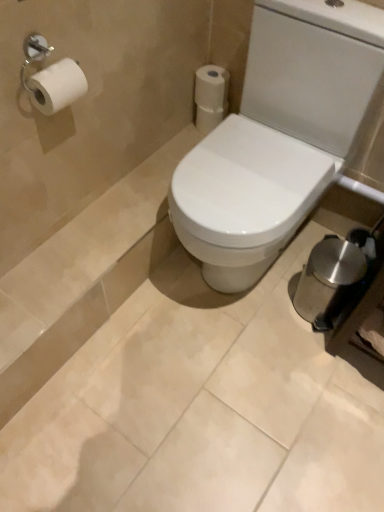
In the scene shown: Measure the distance between point [259,51] and camera.

Point [259,51] and camera are 3.94 feet apart.

Locate an element on the screen. white glossy toilet at center is located at coordinates (278, 136).

Locate an element on the screen. white glossy toilet at center is located at coordinates (278, 136).

From the image's perspective, which is above, white matte toilet paper at upper right, positioned as the 2th toilet paper in back-to-front order, or white glossy toilet at center?

white matte toilet paper at upper right, positioned as the 2th toilet paper in back-to-front order, is shown above in the image.

This screenshot has height=512, width=384. Identify the location of toilet to the right of white matte toilet paper at upper right, positioned as the 2th toilet paper in back-to-front order. (278, 136).

Are white matte toilet paper at upper right, positioned as the 2th toilet paper in back-to-front order, and white glossy toilet at center making contact?

No, white matte toilet paper at upper right, positioned as the 2th toilet paper in back-to-front order, is not next to white glossy toilet at center.

Is white matte toilet paper at upper right, placed as the 1th toilet paper when sorted from front to back, taller or shorter than white glossy toilet at center?

Considering their sizes, white matte toilet paper at upper right, placed as the 1th toilet paper when sorted from front to back, has less height than white glossy toilet at center.

From the image's perspective, is white matte toilet paper at upper center, arranged as the first toilet paper when viewed from the back, on white matte toilet paper at upper right, positioned as the 2th toilet paper in back-to-front order?

Incorrect, from the image's perspective, white matte toilet paper at upper center, arranged as the first toilet paper when viewed from the back, is lower than white matte toilet paper at upper right, positioned as the 2th toilet paper in back-to-front order.

Is white matte toilet paper at upper center, arranged as the first toilet paper when viewed from the back, wider or thinner than white matte toilet paper at upper right, placed as the 1th toilet paper when sorted from front to back?

In the image, white matte toilet paper at upper center, arranged as the first toilet paper when viewed from the back, appears to be wider than white matte toilet paper at upper right, placed as the 1th toilet paper when sorted from front to back.

From a real-world perspective, is white matte toilet paper at upper center, arranged as the first toilet paper when viewed from the back, over white matte toilet paper at upper right, positioned as the 2th toilet paper in back-to-front order?

Incorrect, from a real-world perspective, white matte toilet paper at upper center, arranged as the first toilet paper when viewed from the back, is lower than white matte toilet paper at upper right, positioned as the 2th toilet paper in back-to-front order.

Is white matte toilet paper at upper center, acting as the 2th toilet paper starting from the front, turned away from white matte toilet paper at upper right, placed as the 1th toilet paper when sorted from front to back?

white matte toilet paper at upper center, acting as the 2th toilet paper starting from the front, is not turned away from white matte toilet paper at upper right, placed as the 1th toilet paper when sorted from front to back.

In terms of width, does white matte toilet paper at upper center, acting as the 2th toilet paper starting from the front, look wider or thinner when compared to white glossy toilet at center?

In the image, white matte toilet paper at upper center, acting as the 2th toilet paper starting from the front, appears to be more narrow than white glossy toilet at center.

Is white matte toilet paper at upper center, arranged as the first toilet paper when viewed from the back, facing away from white glossy toilet at center?

No, white matte toilet paper at upper center, arranged as the first toilet paper when viewed from the back,'s orientation is not away from white glossy toilet at center.

Is the surface of white glossy toilet at center in direct contact with white matte toilet paper at upper center, arranged as the first toilet paper when viewed from the back?

white glossy toilet at center and white matte toilet paper at upper center, arranged as the first toilet paper when viewed from the back, are not in contact.

In the scene shown: How many degrees apart are the facing directions of white glossy toilet at center and white matte toilet paper at upper center, arranged as the first toilet paper when viewed from the back?

→ 6.78e-05 degrees.

Considering the sizes of objects white glossy toilet at center and white matte toilet paper at upper center, acting as the 2th toilet paper starting from the front, in the image provided, who is thinner, white glossy toilet at center or white matte toilet paper at upper center, acting as the 2th toilet paper starting from the front,?

white matte toilet paper at upper center, acting as the 2th toilet paper starting from the front, is thinner.

Between white glossy toilet at center and white matte toilet paper at upper center, arranged as the first toilet paper when viewed from the back, which one has smaller size?

Smaller between the two is white matte toilet paper at upper center, arranged as the first toilet paper when viewed from the back.

Identify the location of toilet paper on the left of the white matte toilet paper at upper center, acting as the 2th toilet paper starting from the front. (212, 88).

Is white matte toilet paper at upper right, placed as the 1th toilet paper when sorted from front to back, in front of or behind white matte toilet paper at upper center, arranged as the first toilet paper when viewed from the back, in the image?

Clearly, white matte toilet paper at upper right, placed as the 1th toilet paper when sorted from front to back, is in front of white matte toilet paper at upper center, arranged as the first toilet paper when viewed from the back.

From a real-world perspective, which object stands above the other?

In real-world perspective, white matte toilet paper at upper right, placed as the 1th toilet paper when sorted from front to back, is above.

Is white matte toilet paper at upper right, placed as the 1th toilet paper when sorted from front to back, turned away from white matte toilet paper at upper center, arranged as the first toilet paper when viewed from the back?

white matte toilet paper at upper right, placed as the 1th toilet paper when sorted from front to back, is not turned away from white matte toilet paper at upper center, arranged as the first toilet paper when viewed from the back.

Which is behind, white glossy toilet at center or white matte toilet paper at upper right, positioned as the 2th toilet paper in back-to-front order?

white matte toilet paper at upper right, positioned as the 2th toilet paper in back-to-front order, is further from the camera.

Can you tell me how much white glossy toilet at center and white matte toilet paper at upper right, positioned as the 2th toilet paper in back-to-front order, differ in facing direction?

There is a 5.05e-05-degree angle between the facing directions of white glossy toilet at center and white matte toilet paper at upper right, positioned as the 2th toilet paper in back-to-front order.

Are white glossy toilet at center and white matte toilet paper at upper right, positioned as the 2th toilet paper in back-to-front order, located far from each other?

white glossy toilet at center is actually quite close to white matte toilet paper at upper right, positioned as the 2th toilet paper in back-to-front order.

Locate an element on the screen. toilet on the right of white matte toilet paper at upper right, positioned as the 2th toilet paper in back-to-front order is located at coordinates (278, 136).

Where is `toilet below the white matte toilet paper at upper right, placed as the 1th toilet paper when sorted from front to back (from the image's perspective)`? toilet below the white matte toilet paper at upper right, placed as the 1th toilet paper when sorted from front to back (from the image's perspective) is located at coordinates (278, 136).

Locate an element on the screen. The image size is (384, 512). toilet paper on the right side of white matte toilet paper at upper right, placed as the 1th toilet paper when sorted from front to back is located at coordinates (209, 118).

Based on their spatial positions, is white matte toilet paper at upper right, placed as the 1th toilet paper when sorted from front to back, or white glossy toilet at center further from white matte toilet paper at upper center, acting as the 2th toilet paper starting from the front?

Based on the image, white glossy toilet at center appears to be further to white matte toilet paper at upper center, acting as the 2th toilet paper starting from the front.

Considering their positions, is white glossy toilet at center positioned further to white matte toilet paper at upper center, acting as the 2th toilet paper starting from the front, than white matte toilet paper at upper right, positioned as the 2th toilet paper in back-to-front order?

Among the two, white glossy toilet at center is located further to white matte toilet paper at upper center, acting as the 2th toilet paper starting from the front.

Based on the photo, considering their positions, is white matte toilet paper at upper center, arranged as the first toilet paper when viewed from the back, positioned closer to white glossy toilet at center than white matte toilet paper at upper right, positioned as the 2th toilet paper in back-to-front order?

Based on the image, white matte toilet paper at upper right, positioned as the 2th toilet paper in back-to-front order, appears to be nearer to white glossy toilet at center.

From the picture: From the image, which object appears to be nearer to white matte toilet paper at upper right, positioned as the 2th toilet paper in back-to-front order, white glossy toilet at center or white matte toilet paper at upper center, arranged as the first toilet paper when viewed from the back?

white matte toilet paper at upper center, arranged as the first toilet paper when viewed from the back, lies closer to white matte toilet paper at upper right, positioned as the 2th toilet paper in back-to-front order, than the other object.

Which object lies nearer to the anchor point white matte toilet paper at upper right, positioned as the 2th toilet paper in back-to-front order, white matte toilet paper at upper center, arranged as the first toilet paper when viewed from the back, or white glossy toilet at center?

Based on the image, white matte toilet paper at upper center, arranged as the first toilet paper when viewed from the back, appears to be nearer to white matte toilet paper at upper right, positioned as the 2th toilet paper in back-to-front order.

In the scene shown: When comparing their distances from white glossy toilet at center, does white matte toilet paper at upper right, placed as the 1th toilet paper when sorted from front to back, or white matte toilet paper at upper center, acting as the 2th toilet paper starting from the front, seem further?

The object further to white glossy toilet at center is white matte toilet paper at upper center, acting as the 2th toilet paper starting from the front.

The image size is (384, 512). In order to click on toilet paper located between white glossy toilet at center and white matte toilet paper at upper center, acting as the 2th toilet paper starting from the front, in the depth direction in this screenshot , I will do `click(212, 88)`.